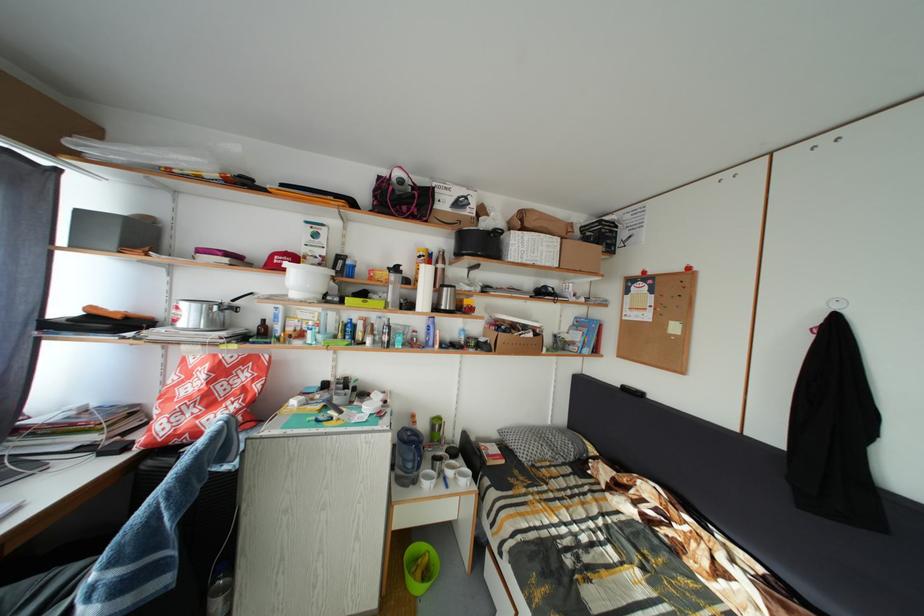
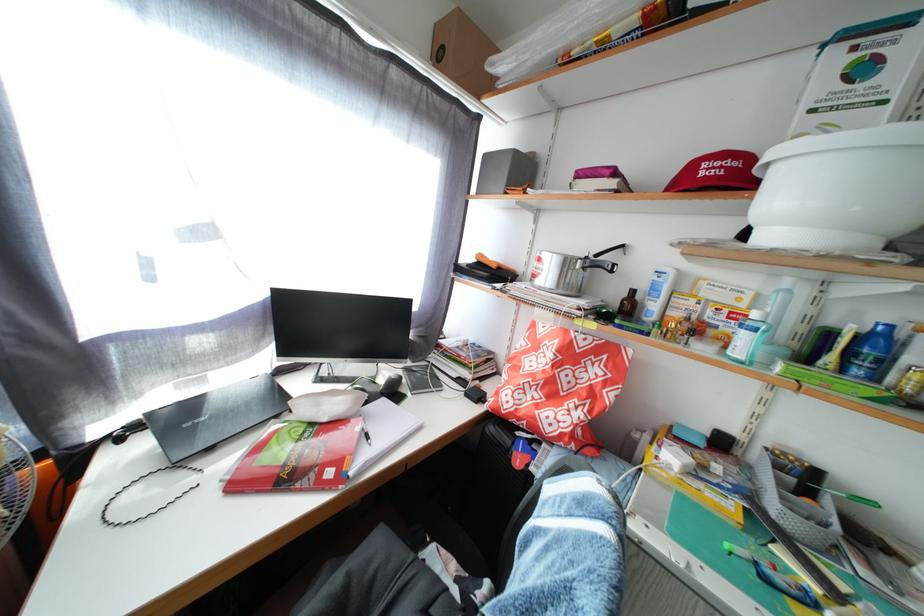
The point at (238, 367) is marked in the first image. Where is the corresponding point in the second image?

(590, 350)